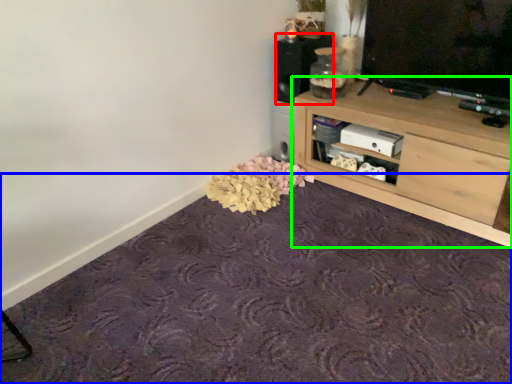
Question: Which object is positioned closest to speaker (highlighted by a red box)? Select from plain (highlighted by a blue box) and shelf (highlighted by a green box).

Choices:
 (A) plain
 (B) shelf

Answer: (B)